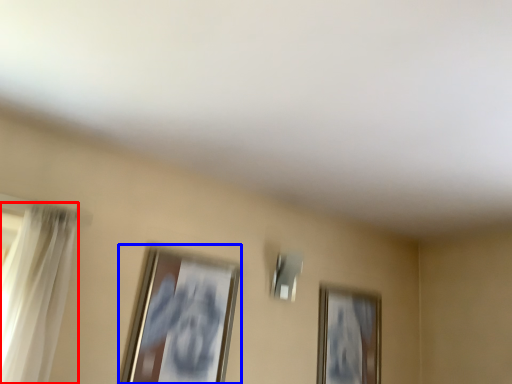
Question: Which object appears closest to the camera in this image, curtain (highlighted by a red box) or picture frame (highlighted by a blue box)?

Choices:
 (A) curtain
 (B) picture frame

Answer: (A)